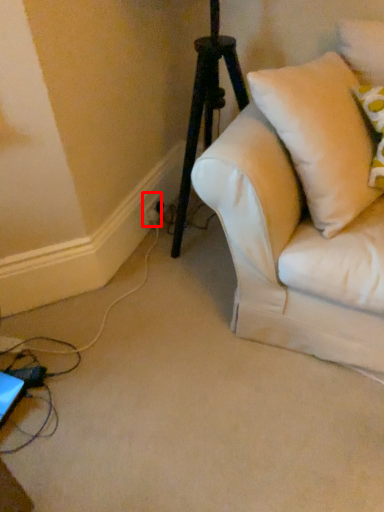
Question: In this image, where is electric outlet (annotated by the red box) located relative to pillow?

Choices:
 (A) right
 (B) left

Answer: (B)